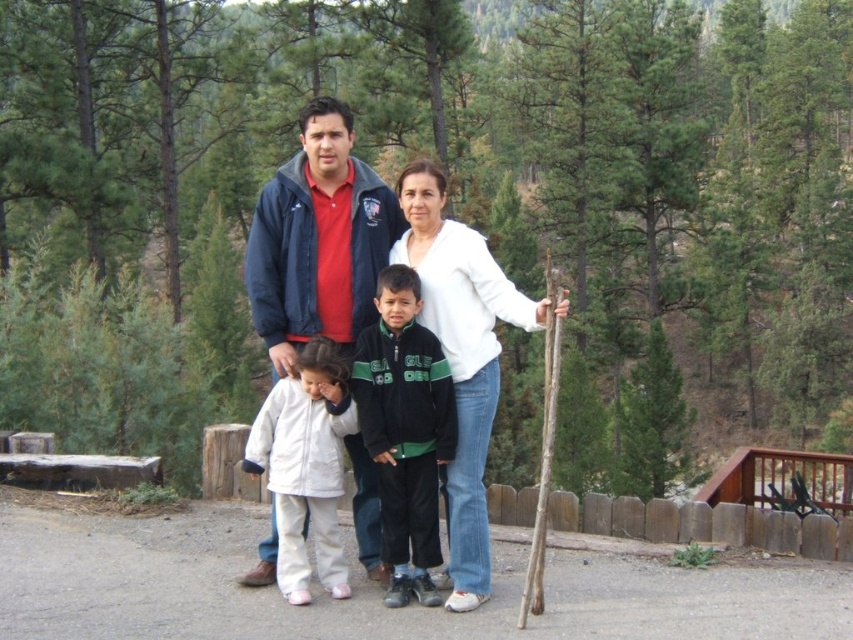
Question: Is blue denim jacket at center to the left of white matte shirt at center from the viewer's perspective?

Choices:
 (A) no
 (B) yes

Answer: (B)

Question: Which point is farther to the camera?

Choices:
 (A) (311, 236)
 (B) (281, 557)
 (C) (463, 481)
 (D) (440, 189)

Answer: (A)

Question: Does green fleece jacket at center have a greater width compared to white fleece jacket at lower left?

Choices:
 (A) no
 (B) yes

Answer: (A)

Question: Estimate the real-world distances between objects in this image. Which object is closer to the matte blue jacket at center?

Choices:
 (A) green fleece jacket at center
 (B) blue denim jacket at center
 (C) white fleece jacket at lower left

Answer: (A)

Question: Can you confirm if matte blue jacket at center is bigger than white matte shirt at center?

Choices:
 (A) no
 (B) yes

Answer: (B)

Question: Which object appears closest to the camera in this image?

Choices:
 (A) blue denim jacket at center
 (B) white matte shirt at center
 (C) green fleece jacket at center
 (D) white fleece jacket at lower left

Answer: (B)